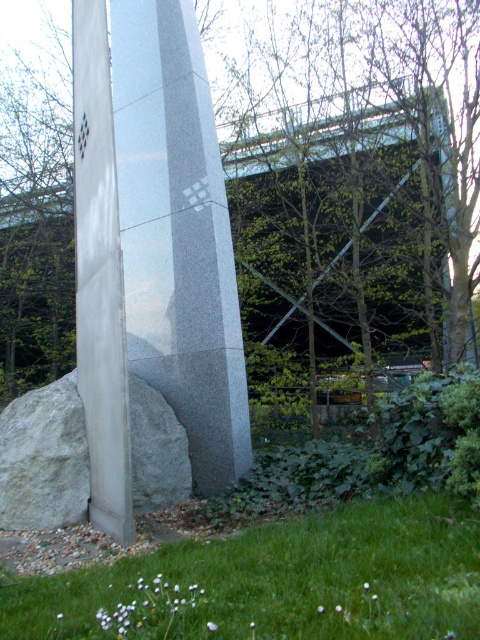
You are standing in front of the stone structure and want to place a 10 feet long banner between the green leafy tree at center and the white polished stone column at center. Can the banner fit between them?

The distance between the green leafy tree at center and the white polished stone column at center is 11.56 feet, so the 10 feet long banner can fit between them since it is shorter than the distance available.

You are a gardener planning to mow the green grass at lower center. To avoid damaging the white marble rock at lower left, which direction should you move the lawnmower relative to the rock?

The green grass at lower center is located below the white marble rock at lower left, so you should move the lawnmower away from the rock towards the lower direction to avoid damaging it.

You are a landscape architect designing a garden path that must pass between the white polished stone column at center and the white marble rock at lower left. The path needs to be at least 6 feet wide to accommodate two people walking side by side. Based on the scene, will the available space between these two objects allow for this width?

The distance between the white polished stone column at center and the white marble rock at lower left is 5.87 feet, which is slightly less than the required 6 feet. Therefore, the path cannot be 6 feet wide in this space.